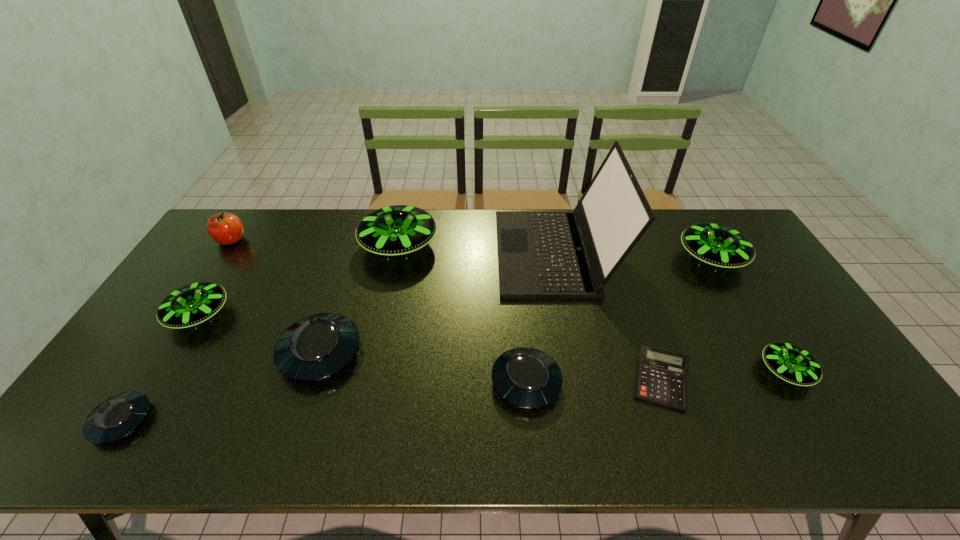
I want to click on apple that is at the left edge, so click(x=224, y=228).

Image resolution: width=960 pixels, height=540 pixels. Find the location of `object present at the far left corner`. object present at the far left corner is located at coordinates (224, 228).

Find the location of `object that is at the near left corner`. object that is at the near left corner is located at coordinates (115, 418).

Where is `object at the far right corner`? Image resolution: width=960 pixels, height=540 pixels. object at the far right corner is located at coordinates point(717,245).

At what (x,y) coordinates should I click in order to perform the action: click on free space at the far edge of the desktop. Please return your answer as a coordinate pair (x, y). Looking at the image, I should click on (294, 244).

At what (x,y) coordinates should I click in order to perform the action: click on blank space at the near edge of the desktop. Please return your answer as a coordinate pair (x, y). The image size is (960, 540). Looking at the image, I should click on (518, 450).

In the image, there is a desktop. Identify the location of vacant space at the left edge. coord(241,255).

Locate an element on the screen. The image size is (960, 540). free space at the right edge of the desktop is located at coordinates (766, 333).

This screenshot has width=960, height=540. In the image, there is a desktop. Identify the location of free space at the far left corner. pos(258,228).

This screenshot has width=960, height=540. Identify the location of vacant space at the near left corner of the desktop. (60, 450).